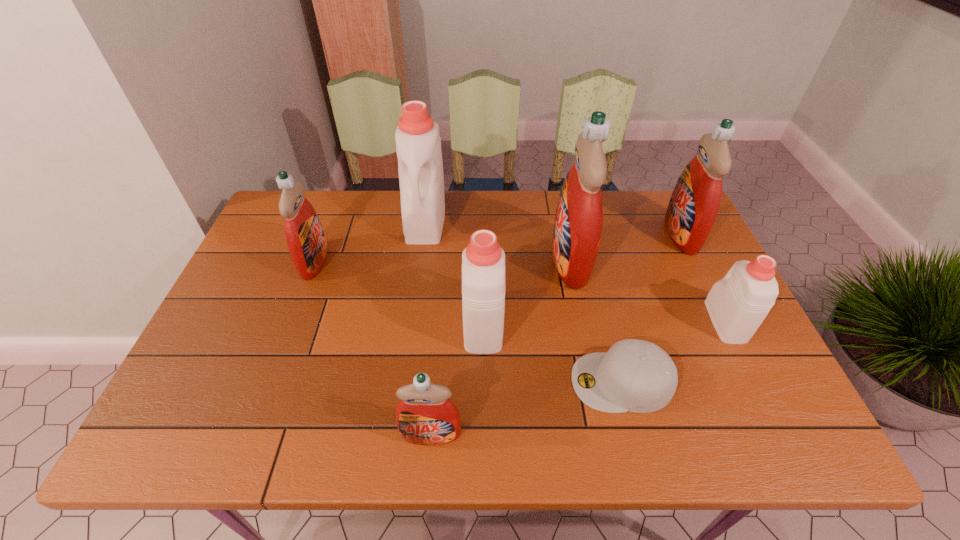
At what (x,y) coordinates should I click in order to perform the action: click on the nearest red detergent. Please return your answer as a coordinate pair (x, y). Image resolution: width=960 pixels, height=540 pixels. Looking at the image, I should click on (425, 415).

Find the location of a particular element. gray cap is located at coordinates (638, 376).

The width and height of the screenshot is (960, 540). Find the location of `cap`. cap is located at coordinates (638, 376).

Where is `vacant space located 0.130m on the front surface of the tallest object`? Image resolution: width=960 pixels, height=540 pixels. vacant space located 0.130m on the front surface of the tallest object is located at coordinates (507, 260).

The image size is (960, 540). I want to click on free space located 0.170m on the front surface of the tallest object, so click(x=492, y=260).

Locate an element on the screen. Image resolution: width=960 pixels, height=540 pixels. free space located 0.290m on the front surface of the tallest object is located at coordinates tap(452, 260).

Locate an element on the screen. The image size is (960, 540). vacant space located on the handle side of the farthest white detergent is located at coordinates (420, 262).

This screenshot has height=540, width=960. I want to click on free space located on the front surface of the second biggest red detergent, so click(540, 234).

Identify the location of vacant region located on the front surface of the second biggest red detergent. (566, 234).

The image size is (960, 540). What are the coordinates of `vacant space located on the front surface of the second biggest red detergent` in the screenshot? It's located at (643, 234).